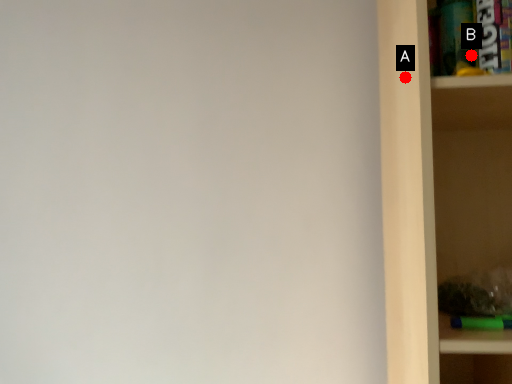
Question: Two points are circled on the image, labeled by A and B beside each circle. Which point is farther to the camera?

Choices:
 (A) A is further
 (B) B is further

Answer: (A)